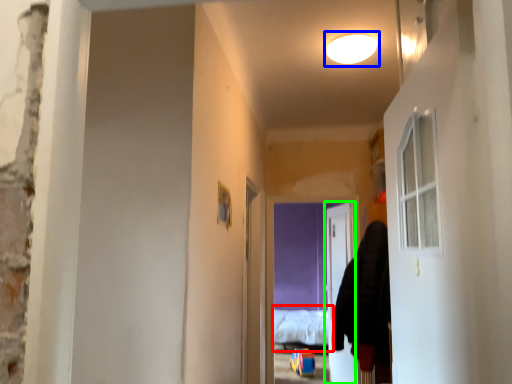
Question: Which is nearer to the bed (highlighted by a red box)? light (highlighted by a blue box) or door (highlighted by a green box).

Choices:
 (A) light
 (B) door

Answer: (B)